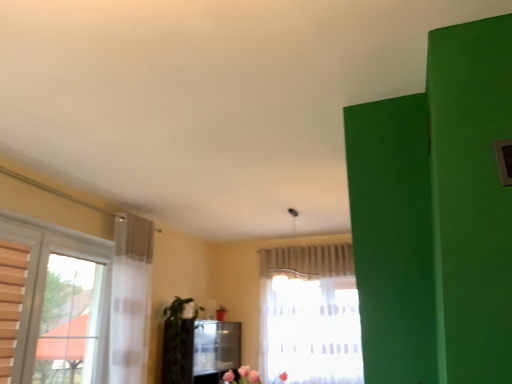
Question: Is point (269, 256) closer or farther from the camera than point (177, 331)?

Choices:
 (A) farther
 (B) closer

Answer: (A)

Question: Is white sheer curtain at center inside the boundaries of green matte plant at lower left, or outside?

Choices:
 (A) outside
 (B) inside

Answer: (A)

Question: In terms of size, does white sheer curtain at center appear bigger or smaller than green matte plant at lower left?

Choices:
 (A) big
 (B) small

Answer: (B)

Question: Is green matte plant at lower left wider or thinner than white sheer curtain at center?

Choices:
 (A) wide
 (B) thin

Answer: (A)

Question: Based on their sizes in the image, would you say green matte plant at lower left is bigger or smaller than white sheer curtain at center?

Choices:
 (A) big
 (B) small

Answer: (A)

Question: From a real-world perspective, is green matte plant at lower left physically located above or below white sheer curtain at center?

Choices:
 (A) above
 (B) below

Answer: (B)

Question: Considering their positions, is green matte plant at lower left located in front of or behind white sheer curtain at center?

Choices:
 (A) behind
 (B) front

Answer: (B)